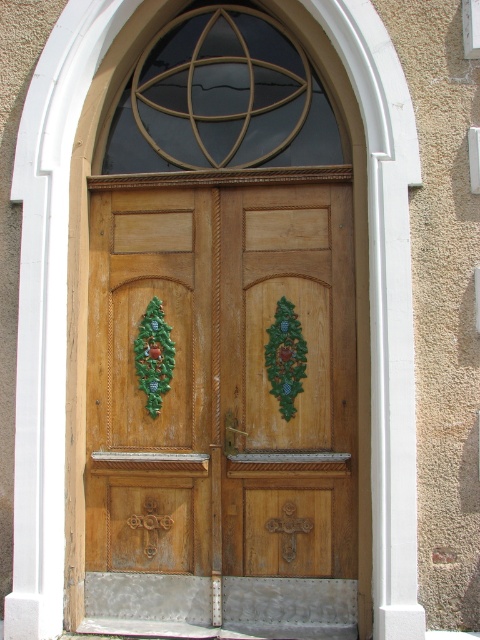
You are standing in front of the wooden double doors. You notice a green textured wreath at center and a wooden door at center. Which object is positioned higher in the image?

The green textured wreath at center is positioned higher than the wooden door at center.

You are a painter standing at the base of the wooden double doors. You want to hang a decorative wreath exactly in the center of the doors. The wreath has a diameter of 12 inches. If the existing green textured wreath at center is already hanging 13.14 inches above the wooden door at center, can you place your new wreath so it overlaps perfectly with the existing one?

The existing green textured wreath at center is 13.14 inches above the wooden door at center. Since your new wreath has a diameter of 12 inches, which is smaller than the distance between them, you cannot overlap them perfectly. You need to position the new wreath closer to the wooden door at center to achieve overlap.

You are standing in front of the wooden double door set within a white arched frame. You need to locate the wooden door at center. Where exactly is it positioned?

The wooden door at center is positioned at point 0.595 on the x axis and 0.469 on the y axis.